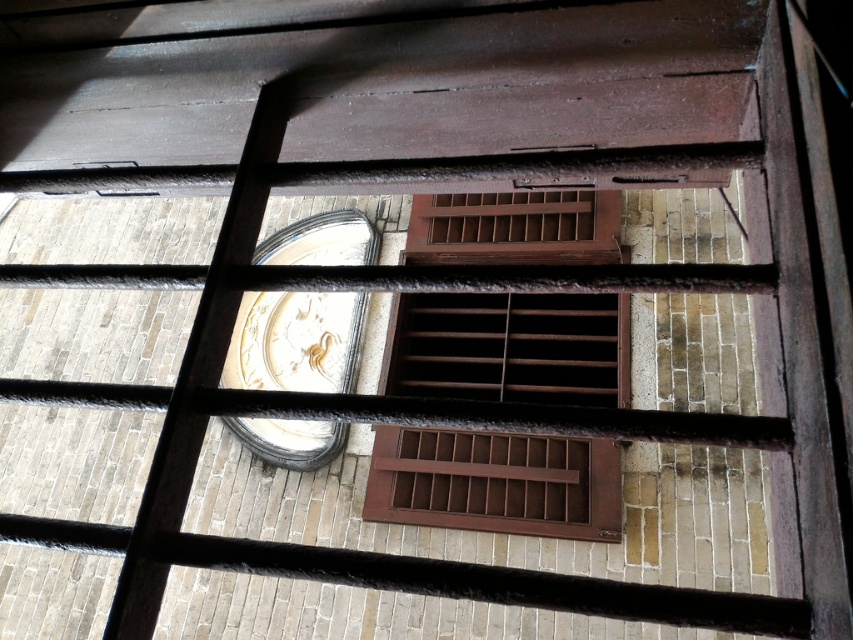
Can you confirm if brown wooden window at center is positioned to the left of gold metallic clock at center-left?

No, brown wooden window at center is not to the left of gold metallic clock at center-left.

Measure the distance between brown wooden window at center and camera.

They are 4.92 meters apart.

This screenshot has height=640, width=853. What do you see at coordinates (509, 348) in the screenshot?
I see `brown wooden window at center` at bounding box center [509, 348].

Where is `brown wooden window at center`? The height and width of the screenshot is (640, 853). brown wooden window at center is located at coordinates (509, 348).